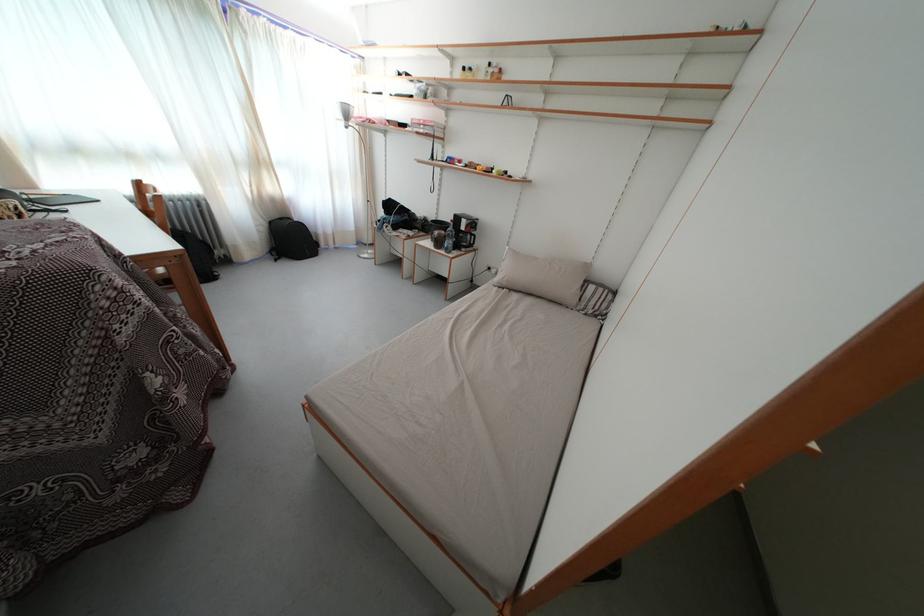
This screenshot has height=616, width=924. What do you see at coordinates (761, 438) in the screenshot?
I see `the wooden door edge` at bounding box center [761, 438].